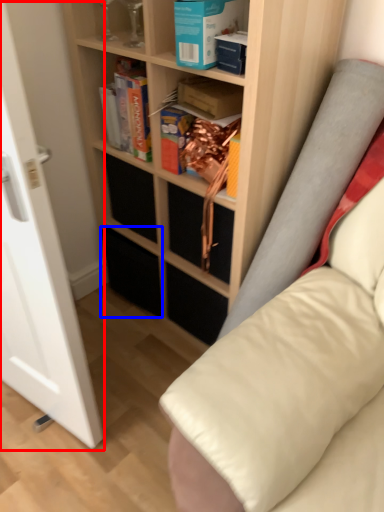
Question: Which of the following is the farthest to the observer, glass door (highlighted by a red box) or drawer (highlighted by a blue box)?

Choices:
 (A) glass door
 (B) drawer

Answer: (B)